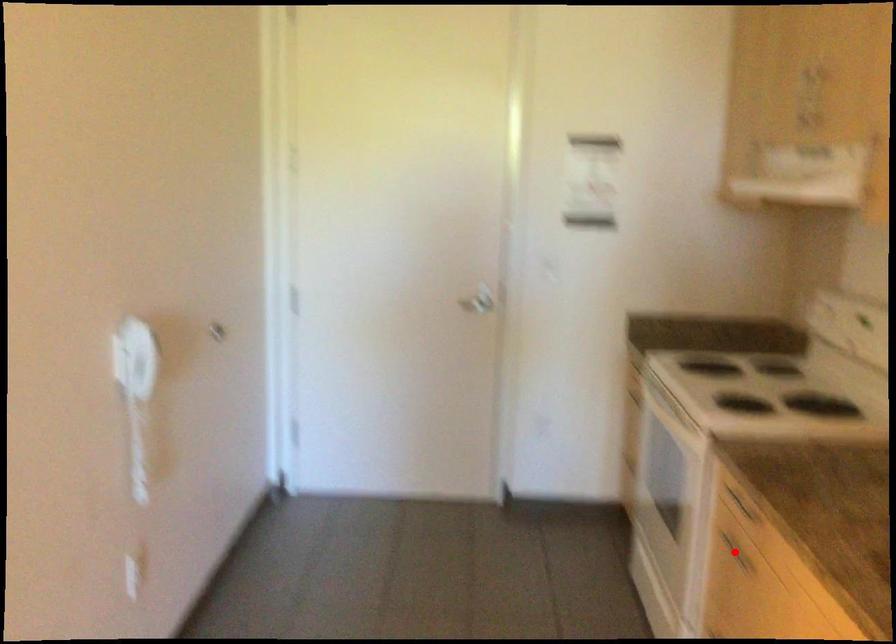
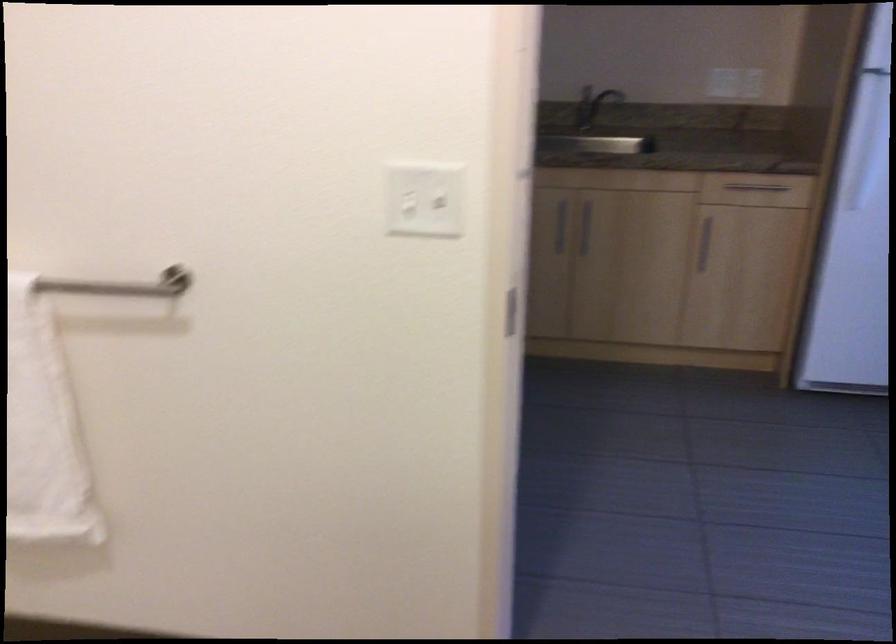
Question: I am providing you with two images of the same scene from different viewpoints. A red point is marked on the first image. Can you still see the location of the red point in image 2?

Choices:
 (A) Yes
 (B) No

Answer: (B)